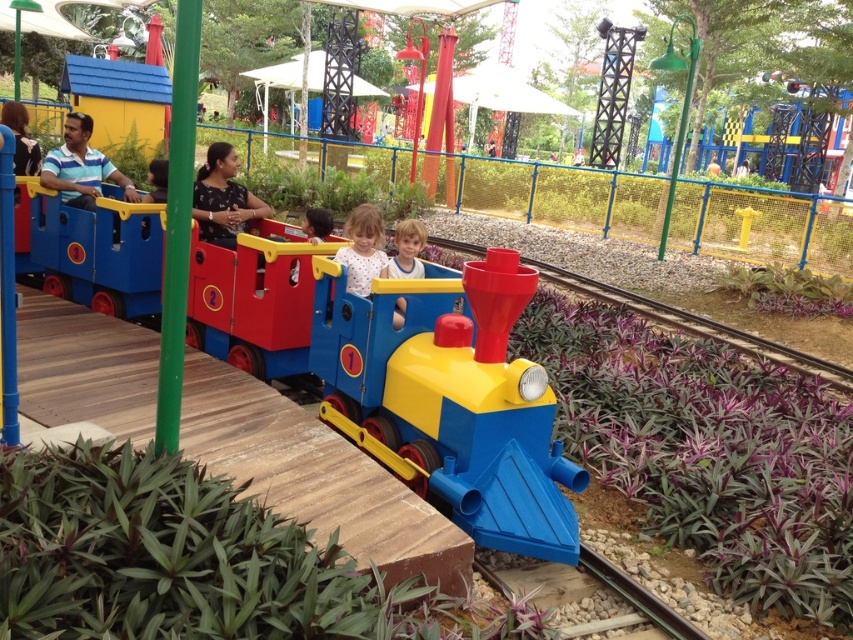
Is matte plastic train at center wider than polka dot fabric child at center?

Correct, the width of matte plastic train at center exceeds that of polka dot fabric child at center.

Can you confirm if matte plastic train at center is positioned to the left of polka dot fabric child at center?

No, matte plastic train at center is not to the left of polka dot fabric child at center.

Find the location of `matte plastic train at center`. matte plastic train at center is located at coordinates tap(450, 397).

Who is higher up, polka dot fabric child at center or matte black shirt at upper left?

Positioned higher is matte black shirt at upper left.

Who is taller, polka dot fabric child at center or matte black shirt at upper left?

polka dot fabric child at center is taller.

Image resolution: width=853 pixels, height=640 pixels. Describe the element at coordinates (363, 250) in the screenshot. I see `polka dot fabric child at center` at that location.

Image resolution: width=853 pixels, height=640 pixels. Identify the location of polka dot fabric child at center. (363, 250).

At what (x,y) coordinates should I click in order to perform the action: click on matte black shirt at center. Please return your answer as a coordinate pair (x, y). This screenshot has height=640, width=853. Looking at the image, I should click on (223, 198).

Who is taller, matte black shirt at center or matte blue shirt at left?

With more height is matte black shirt at center.

Which is behind, point (202, 240) or point (91, 172)?

The point (91, 172) is behind.

Identify the location of matte black shirt at center. (223, 198).